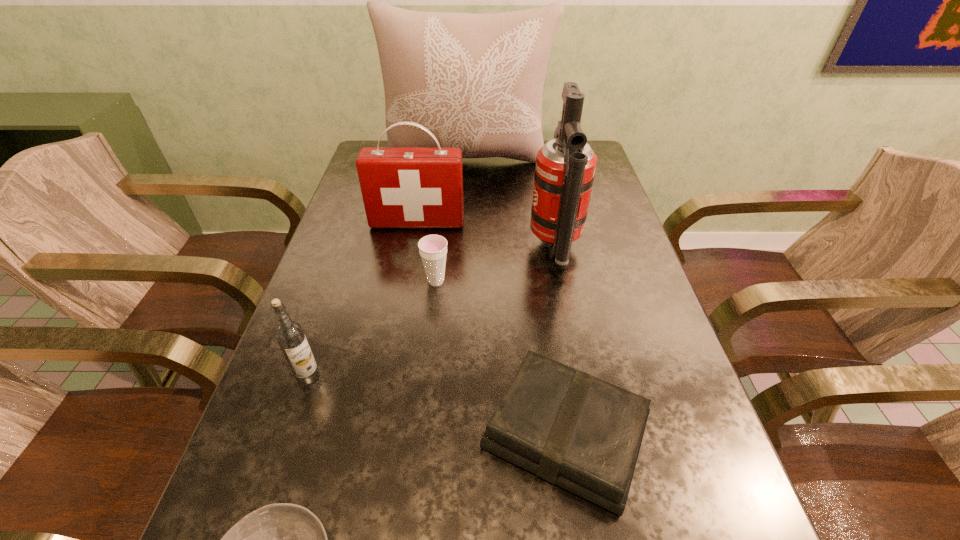
Where is `the tallest object`? the tallest object is located at coordinates (475, 81).

Where is `cushion`? This screenshot has height=540, width=960. cushion is located at coordinates (475, 81).

This screenshot has width=960, height=540. In order to click on the sixth shortest object in this screenshot , I will do `click(565, 168)`.

Image resolution: width=960 pixels, height=540 pixels. I want to click on the third tallest object, so click(402, 187).

Where is `the fourth tallest object`? The height and width of the screenshot is (540, 960). the fourth tallest object is located at coordinates (289, 334).

Find the location of a particular element. the third shortest object is located at coordinates (433, 248).

The image size is (960, 540). Find the location of `book`. book is located at coordinates (566, 426).

Identify the location of free space located on the front side of the tallest object. (466, 216).

Locate an element on the screen. The height and width of the screenshot is (540, 960). free spot located 0.370m on the front label side of the fire extinguisher is located at coordinates (384, 248).

Identify the location of vacant space located 0.360m on the front label side of the fire extinguisher. (388, 248).